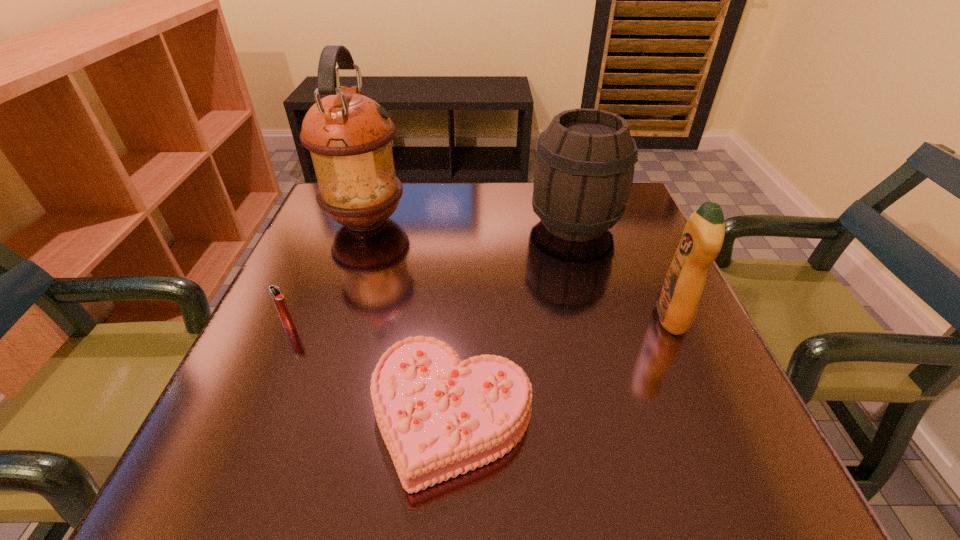
I want to click on vacant region that satisfies the following two spatial constraints: 1. on the back side of the wine bucket; 2. on the right side of the fourth tallest object, so click(x=333, y=223).

Image resolution: width=960 pixels, height=540 pixels. In order to click on vacant space that satisfies the following two spatial constraints: 1. on the back side of the third object from right to left; 2. on the left side of the wine bucket in this screenshot , I will do `click(462, 223)`.

Locate an element on the screen. The width and height of the screenshot is (960, 540). free location that satisfies the following two spatial constraints: 1. on the back side of the oil lamp; 2. on the left side of the second shortest object is located at coordinates (335, 221).

What are the coordinates of `vacant area in the image that satisfies the following two spatial constraints: 1. on the front side of the cake; 2. on the left side of the fourth tallest object` in the screenshot? It's located at (249, 416).